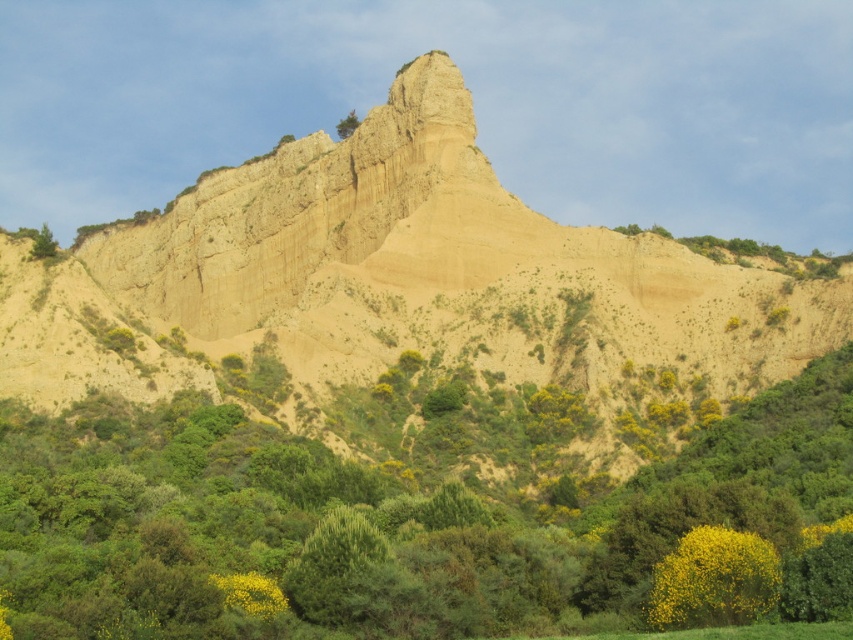
Does green leafy shrub at center appear under yellow leafy bush at lower right?

No.

Which is more to the left, green leafy shrub at center or yellow leafy bush at lower right?

green leafy shrub at center is more to the left.

The height and width of the screenshot is (640, 853). Find the location of `green leafy shrub at center`. green leafy shrub at center is located at coordinates (376, 522).

Between yellow leafy bush at lower right and green leafy tree at upper left, which one has less height?

yellow leafy bush at lower right is shorter.

Is yellow leafy bush at lower right taller than green leafy tree at upper left?

No, yellow leafy bush at lower right is not taller than green leafy tree at upper left.

Consider the image. Measure the distance between point (729, 612) and camera.

→ A distance of 211.20 feet exists between point (729, 612) and camera.

Locate an element on the screen. The width and height of the screenshot is (853, 640). yellow leafy bush at lower right is located at coordinates (714, 579).

Between earthy sandstone cliff at center and green leafy tree at upper left, which one appears on the left side from the viewer's perspective?

From the viewer's perspective, green leafy tree at upper left appears more on the left side.

Who is more forward, (401, 333) or (56, 246)?

Point (56, 246)

This screenshot has width=853, height=640. I want to click on earthy sandstone cliff at center, so click(405, 288).